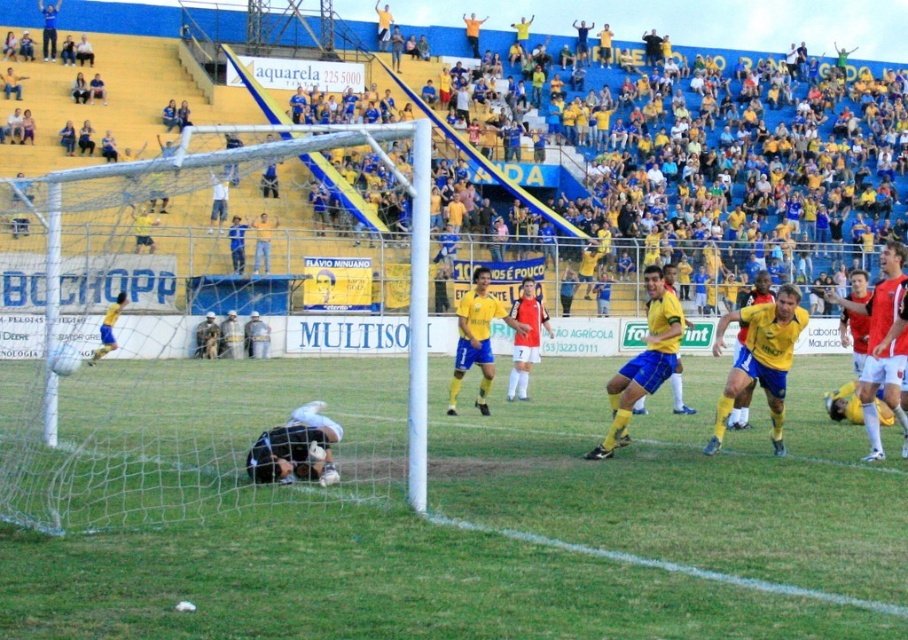
Question: Is yellow jersey at center above yellow matte jersey at center?

Choices:
 (A) yes
 (B) no

Answer: (A)

Question: Among these objects, which one is farthest from the camera?

Choices:
 (A) yellow matte jersey at center
 (B) dark blue jersey at lower center

Answer: (A)

Question: Which point is closer to the camera?

Choices:
 (A) green grass at center
 (B) yellow matte jersey at center
 (C) dark blue jersey at lower center

Answer: (A)

Question: Can you confirm if yellow jersey at center is smaller than yellow matte jersey at center?

Choices:
 (A) yes
 (B) no

Answer: (B)

Question: Which object is closer to the camera taking this photo?

Choices:
 (A) yellow jersey at center
 (B) green grass at center
 (C) yellow matte jersey at center
 (D) dark blue jersey at lower center

Answer: (B)

Question: Can you confirm if green grass at center is smaller than dark blue jersey at lower center?

Choices:
 (A) no
 (B) yes

Answer: (A)